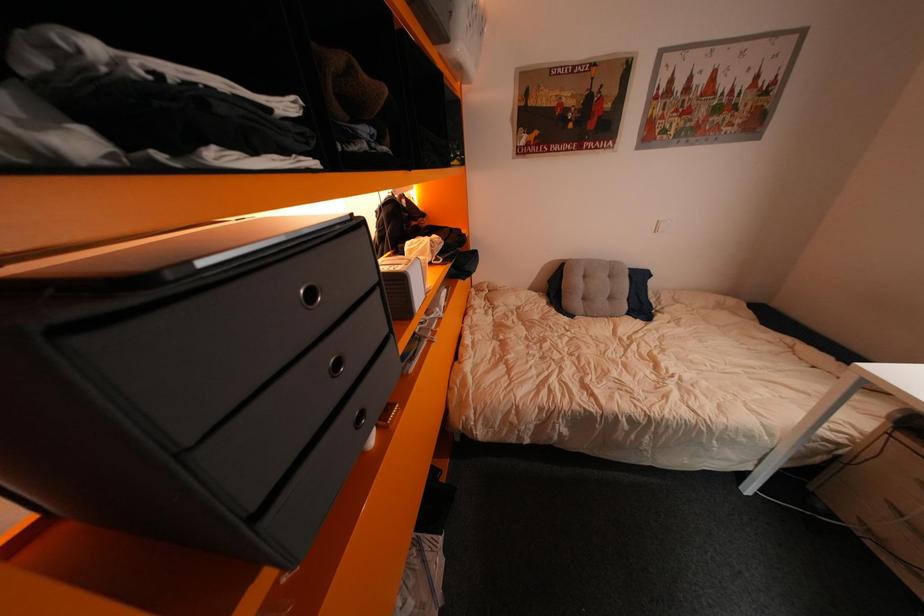
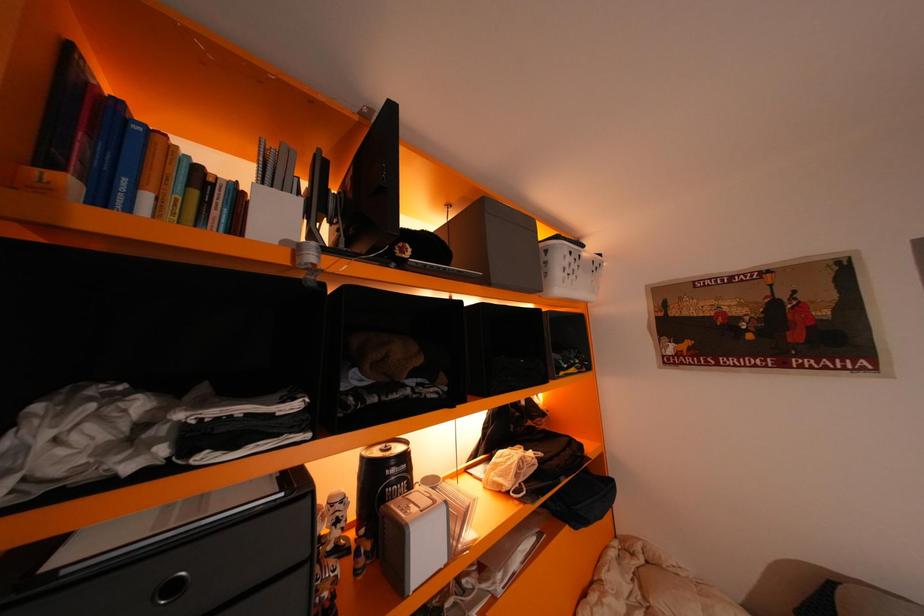
First-person continuous shooting, in which direction is the camera rotating?

The rotation direction of the camera is left-up.